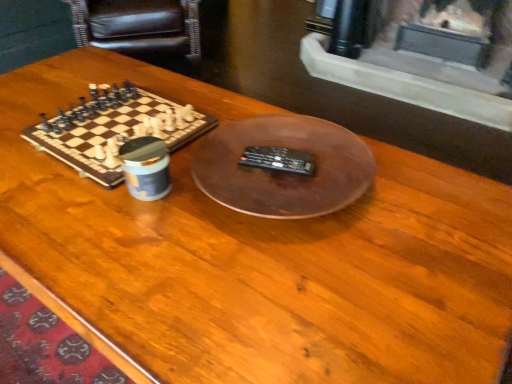
Question: Considering the positions of wooden chessboard at left and black leather armchair at upper left in the image, is wooden chessboard at left taller or shorter than black leather armchair at upper left?

Choices:
 (A) short
 (B) tall

Answer: (A)

Question: Considering their positions, is wooden chessboard at left located in front of or behind black leather armchair at upper left?

Choices:
 (A) behind
 (B) front

Answer: (B)

Question: In terms of size, does wooden chessboard at left appear bigger or smaller than black leather armchair at upper left?

Choices:
 (A) small
 (B) big

Answer: (A)

Question: Is black leather armchair at upper left wider or thinner than wooden chessboard at left?

Choices:
 (A) wide
 (B) thin

Answer: (A)

Question: Considering the positions of point (96, 16) and point (66, 114), is point (96, 16) closer or farther from the camera than point (66, 114)?

Choices:
 (A) farther
 (B) closer

Answer: (A)

Question: From a real-world perspective, relative to wooden chessboard at left, is black leather armchair at upper left vertically above or below?

Choices:
 (A) below
 (B) above

Answer: (A)

Question: Would you say black leather armchair at upper left is to the left or to the right of wooden chessboard at left in the picture?

Choices:
 (A) right
 (B) left

Answer: (B)